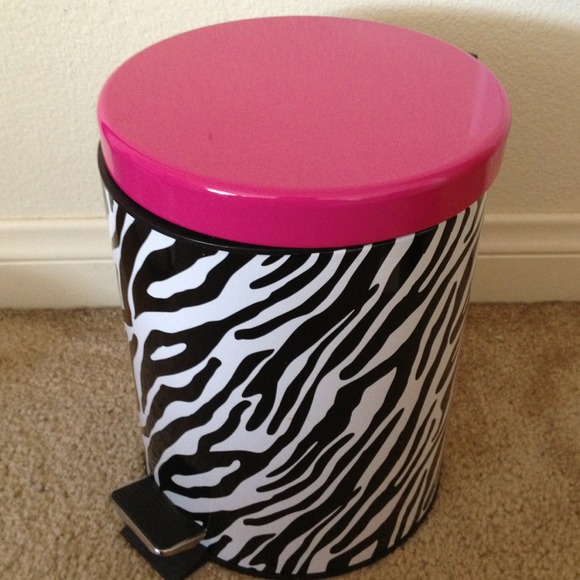
Where is `baseboard`? The height and width of the screenshot is (580, 580). baseboard is located at coordinates (500, 271).